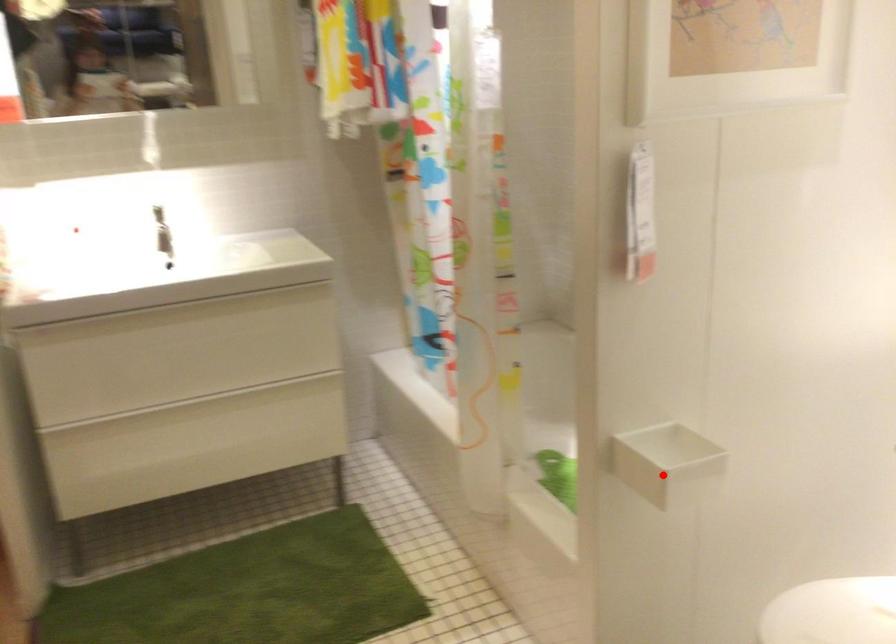
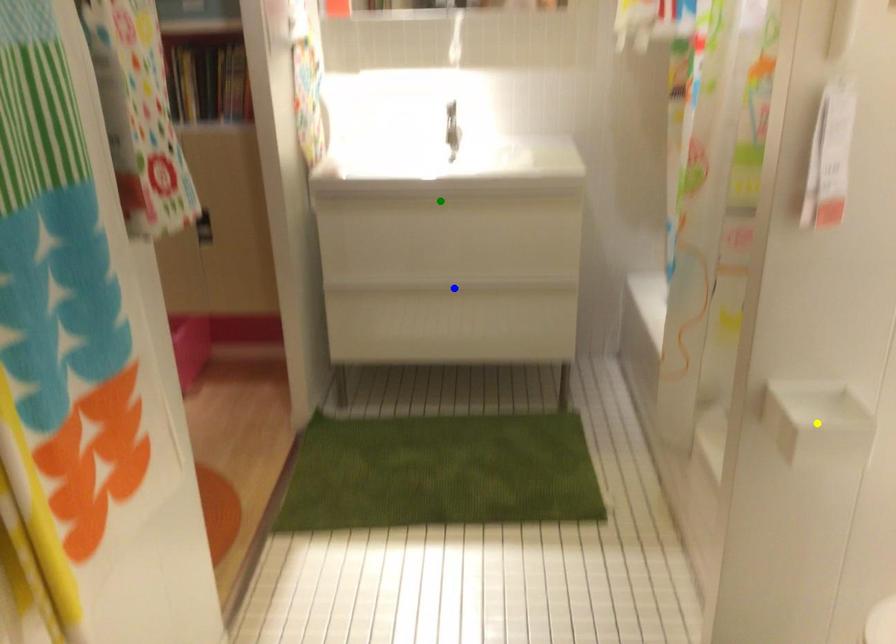
Question: I am providing you with two images of the same scene from different viewpoints. A red point is marked on the first image. You are given multiple points on the second image. Which mark in image 2 goes with the point in image 1?

Choices:
 (A) blue point
 (B) green point
 (C) yellow point

Answer: (C)